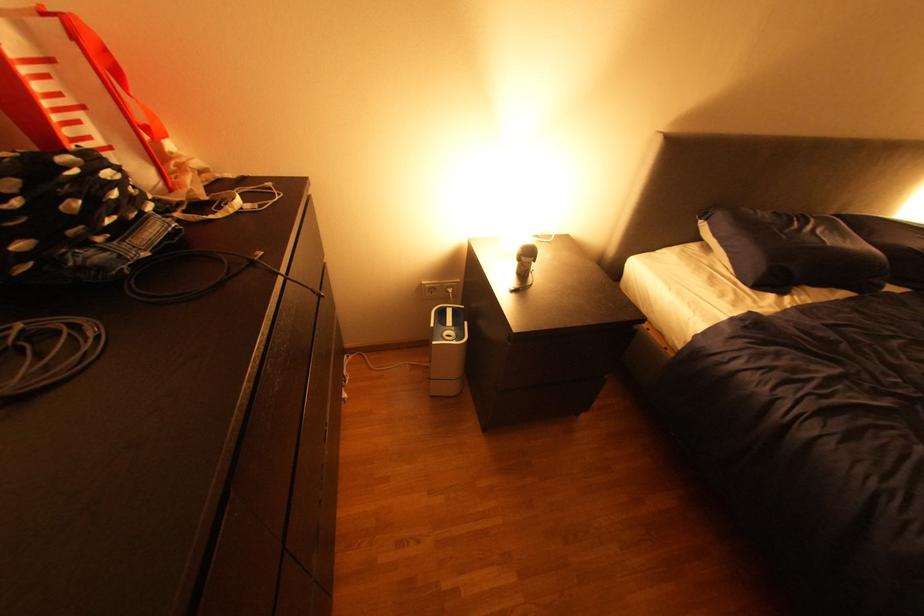
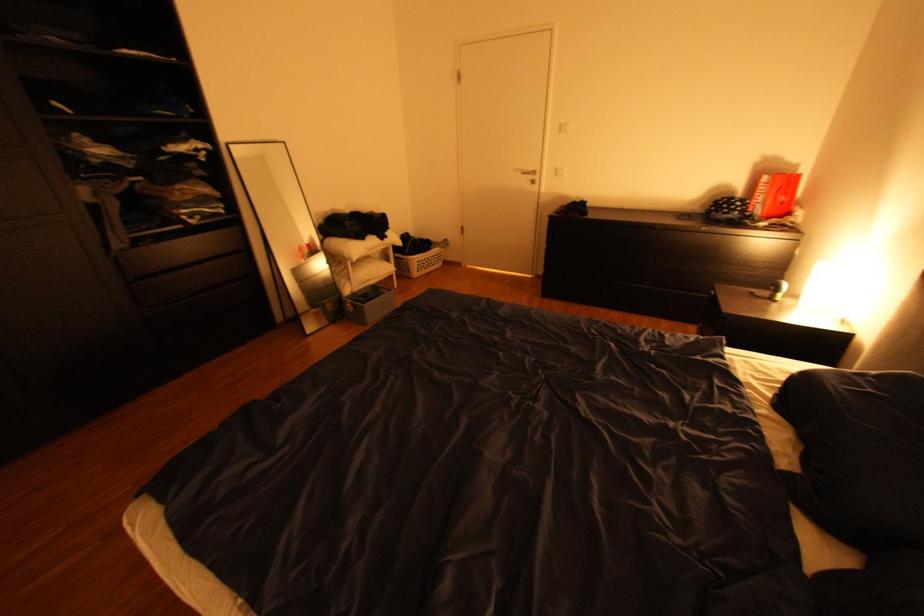
Where in the second image is the point corresponding to (141,190) from the first image?

(748, 208)